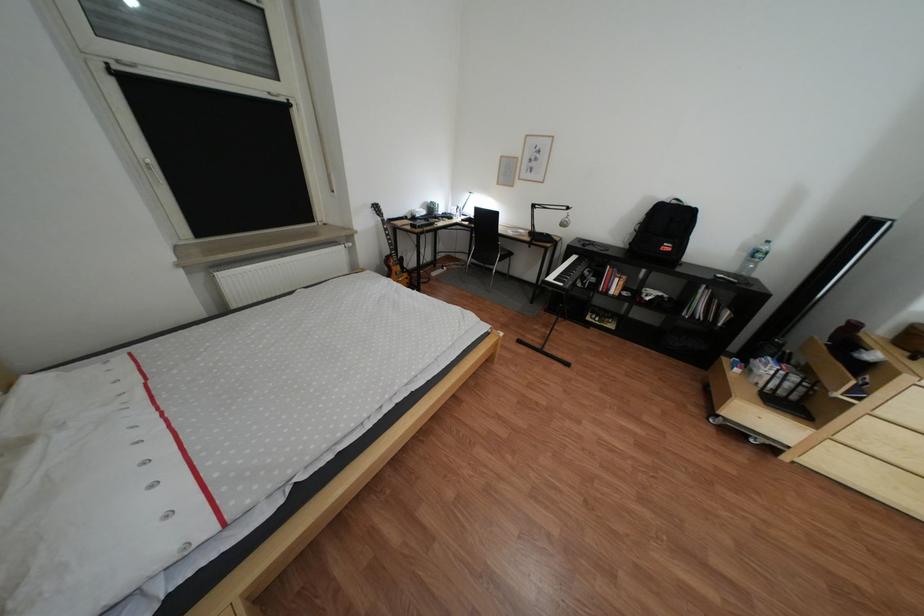
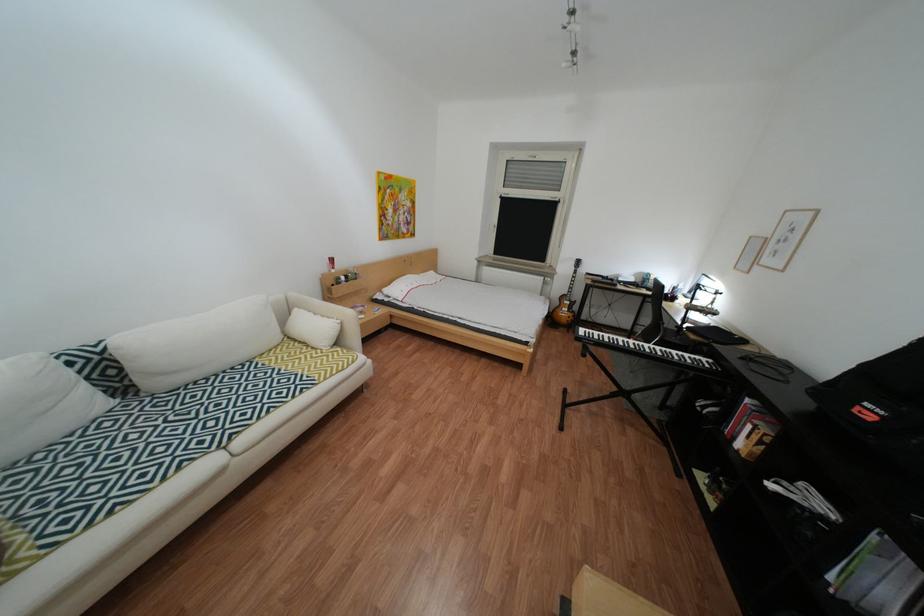
Find the pixel in the second image that matches point (624, 291) in the first image.

(749, 439)